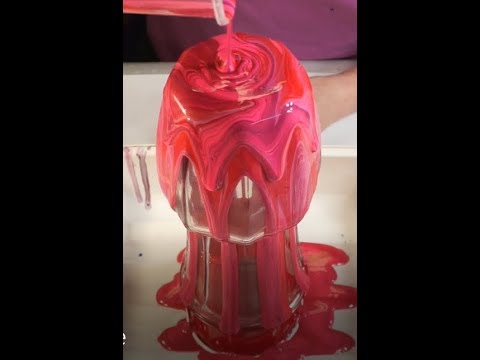
The height and width of the screenshot is (360, 480). Find the location of `cup`. cup is located at coordinates (211, 13).